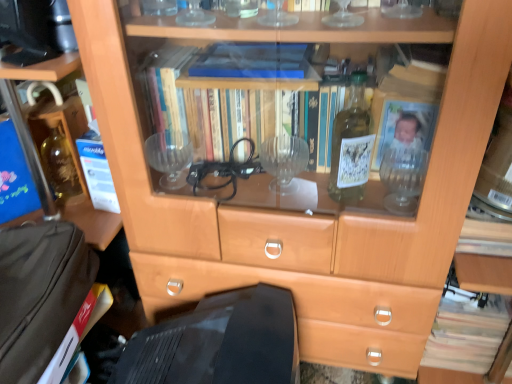
Question: Does brown paper at left, placed as the first paperback book when sorted from bottom to top, appear on the right side of white paper at left, which is the 1th paperback book in top-to-bottom order?

Choices:
 (A) yes
 (B) no

Answer: (B)

Question: Is the depth of brown paper at left, placed as the first paperback book when sorted from bottom to top, less than that of white paper at left, which ranks as the second paperback book in bottom-to-top order?

Choices:
 (A) yes
 (B) no

Answer: (A)

Question: Is brown paper at left, placed as the first paperback book when sorted from bottom to top, placed right next to white paper at left, which ranks as the second paperback book in bottom-to-top order?

Choices:
 (A) no
 (B) yes

Answer: (A)

Question: Is brown paper at left, placed as the first paperback book when sorted from bottom to top, not close to white paper at left, which is the 1th paperback book in top-to-bottom order?

Choices:
 (A) no
 (B) yes

Answer: (A)

Question: Is brown paper at left, placed as the first paperback book when sorted from bottom to top, behind white paper at left, which ranks as the second paperback book in bottom-to-top order?

Choices:
 (A) no
 (B) yes

Answer: (A)

Question: Does point coord(103,205) appear closer or farther from the camera than point coord(31,322)?

Choices:
 (A) farther
 (B) closer

Answer: (A)

Question: Looking at their shapes, would you say white paper at left, which is the 1th paperback book in top-to-bottom order, is wider or thinner than brown fabric suitcase at lower left?

Choices:
 (A) thin
 (B) wide

Answer: (A)

Question: From a real-world perspective, is white paper at left, which is the 1th paperback book in top-to-bottom order, physically located above or below brown fabric suitcase at lower left?

Choices:
 (A) above
 (B) below

Answer: (A)

Question: In terms of size, does white paper at left, which is the 1th paperback book in top-to-bottom order, appear bigger or smaller than brown fabric suitcase at lower left?

Choices:
 (A) big
 (B) small

Answer: (B)

Question: Based on their positions, is brown fabric suitcase at lower left located to the left or right of brown paper at left, placed as the first paperback book when sorted from bottom to top?

Choices:
 (A) left
 (B) right

Answer: (A)

Question: Relative to brown paper at left, placed as the first paperback book when sorted from bottom to top, is brown fabric suitcase at lower left in front or behind?

Choices:
 (A) behind
 (B) front

Answer: (B)

Question: Based on their sizes in the image, would you say brown fabric suitcase at lower left is bigger or smaller than brown paper at left, which is the second paperback book in top-to-bottom order?

Choices:
 (A) small
 (B) big

Answer: (B)

Question: Considering the positions of point (5, 259) and point (53, 377), is point (5, 259) closer or farther from the camera than point (53, 377)?

Choices:
 (A) farther
 (B) closer

Answer: (A)

Question: Does point (503, 322) appear closer or farther from the camera than point (94, 289)?

Choices:
 (A) farther
 (B) closer

Answer: (A)

Question: Is light brown paper book at lower right inside or outside of brown paper at left, placed as the first paperback book when sorted from bottom to top?

Choices:
 (A) outside
 (B) inside

Answer: (A)